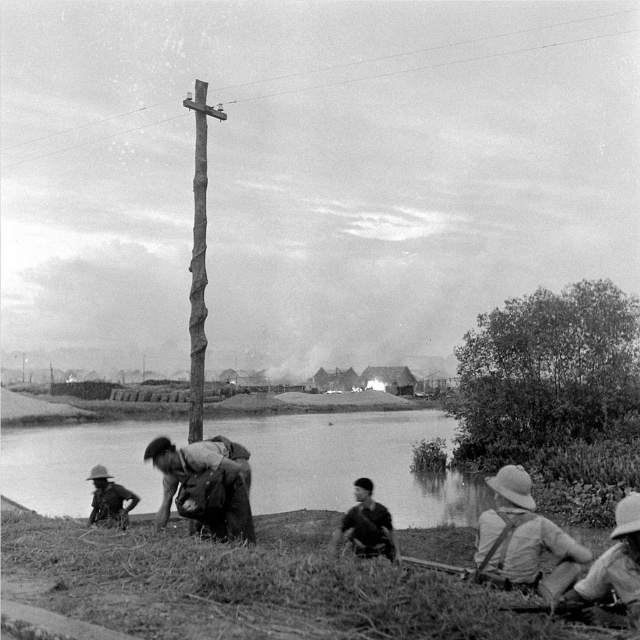
Question: Is khaki fabric hat at lower right to the right of light brown leather hat at lower right from the viewer's perspective?

Choices:
 (A) no
 (B) yes

Answer: (A)

Question: Which point is closer to the camera taking this photo?

Choices:
 (A) (90, 467)
 (B) (624, 596)

Answer: (B)

Question: Among these objects, which one is farthest from the camera?

Choices:
 (A) matte khaki helmet at lower left
 (B) rough wood telegraph pole at center
 (C) thick foliage at right
 (D) dark brown uniform at lower center

Answer: (C)

Question: Is thick foliage at right further to camera compared to dark brown uniform at lower center?

Choices:
 (A) yes
 (B) no

Answer: (A)

Question: From the image, what is the correct spatial relationship of dark brown fabric bag at lower center in relation to matte khaki helmet at lower left?

Choices:
 (A) above
 (B) below

Answer: (A)

Question: Which object is farther from the camera taking this photo?

Choices:
 (A) thick foliage at right
 (B) light brown leather hat at lower right

Answer: (A)